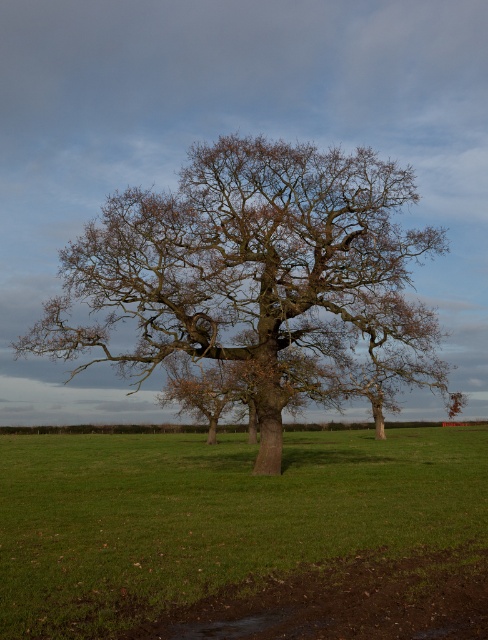
Question: Which point is farther to the camera?

Choices:
 (A) green grass at center
 (B) brown rough bark oak tree at center

Answer: (B)

Question: Which of the following is the closest to the observer?

Choices:
 (A) brown rough bark oak tree at center
 (B) green grass at center

Answer: (B)

Question: Which point is closer to the camera?

Choices:
 (A) (466, 506)
 (B) (226, 214)

Answer: (A)

Question: In this image, where is brown rough bark oak tree at center located relative to green grass at center?

Choices:
 (A) above
 (B) below

Answer: (A)

Question: From the image, what is the correct spatial relationship of brown rough bark oak tree at center in relation to green grass at center?

Choices:
 (A) below
 (B) above

Answer: (B)

Question: Where is brown rough bark oak tree at center located in relation to green grass at center in the image?

Choices:
 (A) right
 (B) left

Answer: (A)